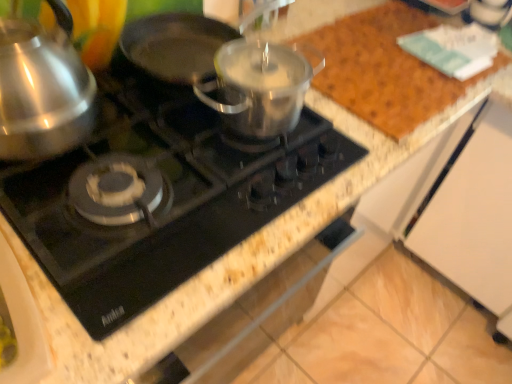
The width and height of the screenshot is (512, 384). I want to click on black glass gas stove at center, so click(162, 201).

What do you see at coordinates (162, 201) in the screenshot? Image resolution: width=512 pixels, height=384 pixels. I see `black glass gas stove at center` at bounding box center [162, 201].

Describe the element at coordinates (42, 89) in the screenshot. I see `satin silver kettle at left` at that location.

I want to click on satin silver kettle at left, so click(42, 89).

The height and width of the screenshot is (384, 512). I want to click on black glass gas stove at center, so click(x=162, y=201).

Which object is positioned more to the left, satin silver kettle at left or black glass gas stove at center?

Positioned to the left is satin silver kettle at left.

Which object is further away from the camera, satin silver kettle at left or black glass gas stove at center?

black glass gas stove at center is further from the camera.

Does point (28, 148) come in front of point (102, 335)?

No, it is not.

From the image's perspective, is satin silver kettle at left above black glass gas stove at center?

Yes.

From a real-world perspective, is satin silver kettle at left positioned over black glass gas stove at center based on gravity?

Yes, from a real-world perspective, satin silver kettle at left is on top of black glass gas stove at center.

Between satin silver kettle at left and black glass gas stove at center, which one has larger width?

With larger width is black glass gas stove at center.

Can you confirm if satin silver kettle at left is shorter than black glass gas stove at center?

In fact, satin silver kettle at left may be taller than black glass gas stove at center.

Can you confirm if satin silver kettle at left is smaller than black glass gas stove at center?

Yes.

Is black glass gas stove at center completely or partially inside satin silver kettle at left?

No, black glass gas stove at center is not a part of satin silver kettle at left.

Is there a large distance between satin silver kettle at left and black glass gas stove at center?

No, there isn't a large distance between satin silver kettle at left and black glass gas stove at center.

Is satin silver kettle at left facing towards black glass gas stove at center?

No.

How distant is satin silver kettle at left from black glass gas stove at center?

A distance of 17.75 centimeters exists between satin silver kettle at left and black glass gas stove at center.

You are a GUI agent. You are given a task and a screenshot of the screen. Output one action in this format:
    pyautogui.click(x=<x>, y=<y>)
    Task: Click on the gas stove below the satin silver kettle at left (from the image's perspective)
    
    Given the screenshot: What is the action you would take?
    pyautogui.click(x=162, y=201)

Is black glass gas stove at center to the left of satin silver kettle at left from the viewer's perspective?

In fact, black glass gas stove at center is to the right of satin silver kettle at left.

Is the depth of black glass gas stove at center less than that of satin silver kettle at left?

No, black glass gas stove at center is further to the viewer.

Does point (160, 272) come closer to viewer compared to point (31, 105)?

That is True.

In the scene shown: From the image's perspective, which object appears higher, black glass gas stove at center or satin silver kettle at left?

satin silver kettle at left is shown above in the image.

From a real-world perspective, which is physically below, black glass gas stove at center or satin silver kettle at left?

From a 3D spatial view, black glass gas stove at center is below.

Considering the sizes of objects black glass gas stove at center and satin silver kettle at left in the image provided, who is thinner, black glass gas stove at center or satin silver kettle at left?

satin silver kettle at left is thinner.

Considering the sizes of black glass gas stove at center and satin silver kettle at left in the image, is black glass gas stove at center taller or shorter than satin silver kettle at left?

Clearly, black glass gas stove at center is shorter compared to satin silver kettle at left.

Is black glass gas stove at center bigger than satin silver kettle at left?

Yes, black glass gas stove at center is bigger than satin silver kettle at left.

Would you say black glass gas stove at center contains satin silver kettle at left?

No, black glass gas stove at center does not contain satin silver kettle at left.

Is black glass gas stove at center touching satin silver kettle at left?

No, black glass gas stove at center is not touching satin silver kettle at left.

Is black glass gas stove at center aimed at satin silver kettle at left?

No.

The height and width of the screenshot is (384, 512). There is a black glass gas stove at center. Identify the location of kitchen appliance above it (from a real-world perspective). (42, 89).

The image size is (512, 384). What are the coordinates of `kitchen appliance above the black glass gas stove at center (from a real-world perspective)` in the screenshot? It's located at (42, 89).

The height and width of the screenshot is (384, 512). Identify the location of kitchen appliance that appears above the black glass gas stove at center (from the image's perspective). (42, 89).